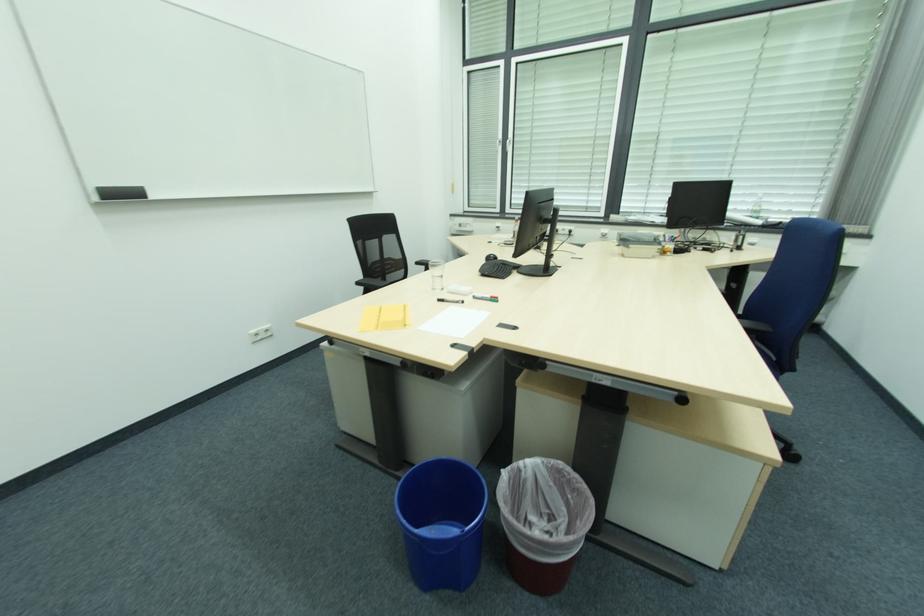
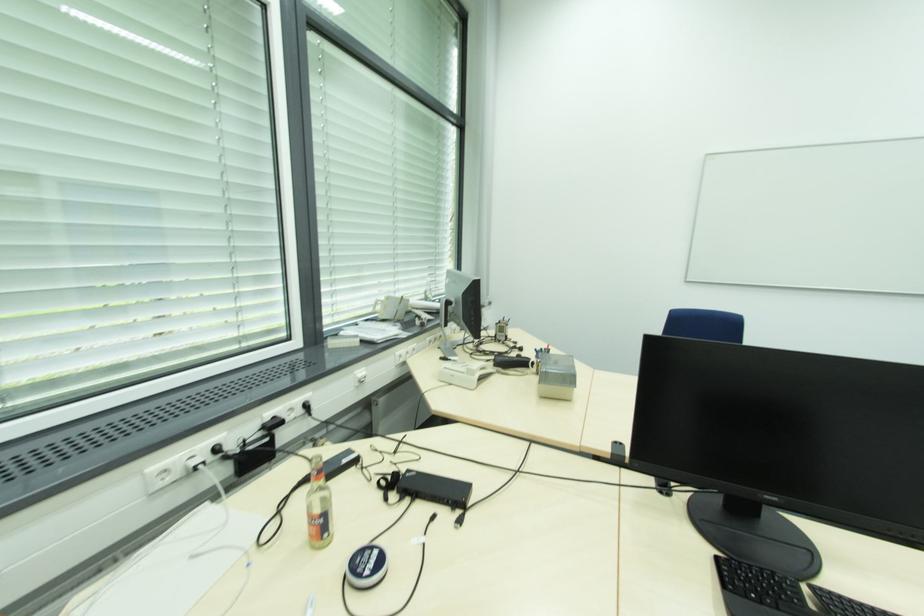
Locate, in the second image, the point that corresponds to (565,230) in the first image.

(294, 410)